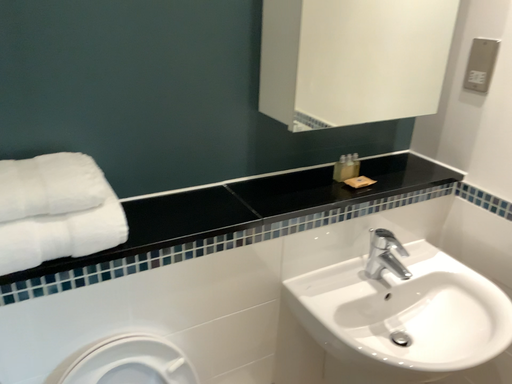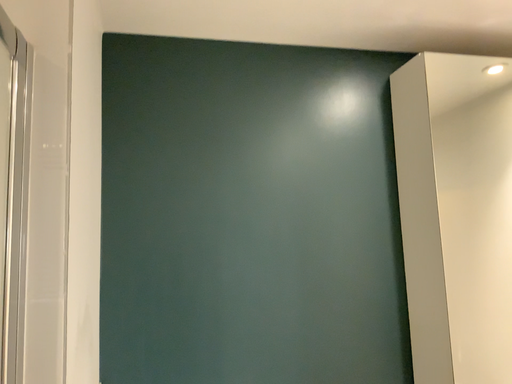
Question: How did the camera likely rotate when shooting the video?

Choices:
 (A) rotated upward
 (B) rotated downward

Answer: (A)